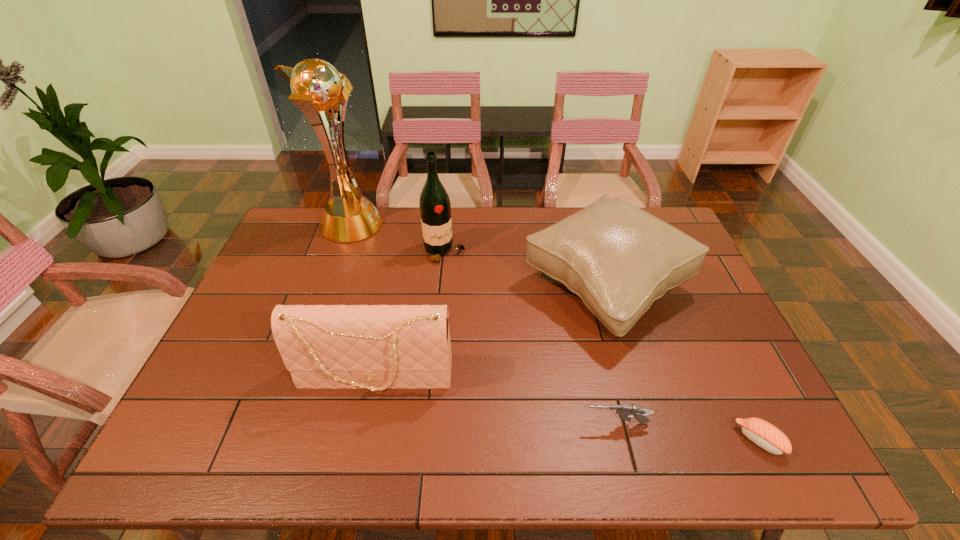
Locate an element on the screen. Image resolution: width=960 pixels, height=540 pixels. unoccupied area between the sushi and the trophy is located at coordinates (554, 333).

Locate an element on the screen. The image size is (960, 540). vacant area between the sushi and the handbag is located at coordinates (567, 409).

The image size is (960, 540). I want to click on free point between the second tallest object and the shortest object, so click(602, 346).

You are a GUI agent. You are given a task and a screenshot of the screen. Output one action in this format:
    pyautogui.click(x=<x>, y=<y>)
    Task: Click on the vacant area between the handbag and the trophy
    
    Given the screenshot: What is the action you would take?
    pyautogui.click(x=363, y=302)

At what (x,y) coordinates should I click in order to perform the action: click on free point between the shortest object and the fifth tallest object. Please return your answer as a coordinate pair (x, y). Looking at the image, I should click on (687, 432).

Where is `unoccupied position between the cushion and the wine bottle`? unoccupied position between the cushion and the wine bottle is located at coordinates (525, 269).

Find the location of `vacant space in between the fifth shortest object and the cushion`. vacant space in between the fifth shortest object and the cushion is located at coordinates (525, 269).

The width and height of the screenshot is (960, 540). I want to click on vacant space in between the cushion and the shortest object, so click(683, 363).

Where is `vacant region between the wine bottle and the gun`? The height and width of the screenshot is (540, 960). vacant region between the wine bottle and the gun is located at coordinates (530, 338).

In order to click on the third closest object to the shortest object in this screenshot , I will do click(x=376, y=347).